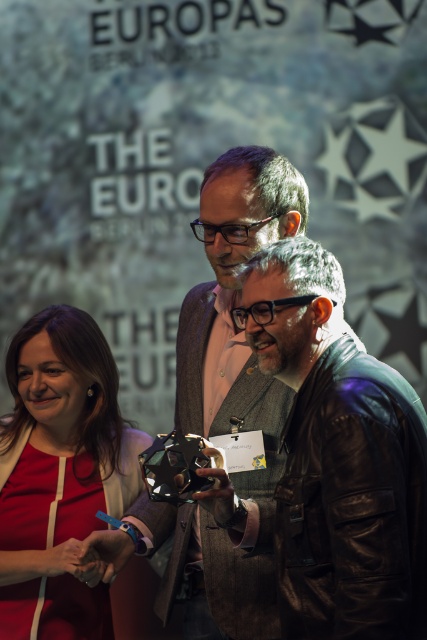
Which of these two, leather jacket at center or matte red dress at lower left, stands shorter?

Standing shorter between the two is leather jacket at center.

Is point (242, 300) positioned in front of point (29, 497)?

Yes, it is in front of point (29, 497).

I want to click on leather jacket at center, so 339,458.